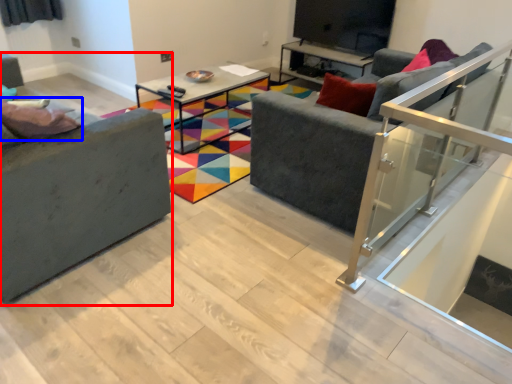
Question: Which object is further to the camera taking this photo, studio couch (highlighted by a red box) or pillow (highlighted by a blue box)?

Choices:
 (A) studio couch
 (B) pillow

Answer: (B)